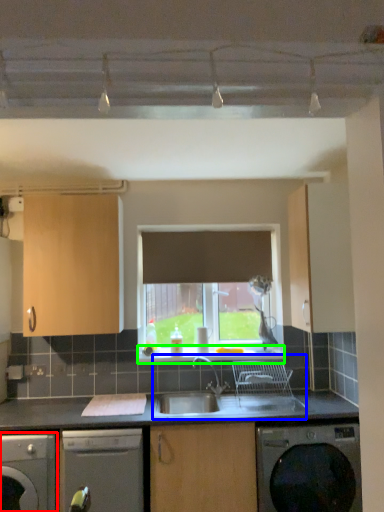
Question: Based on their relative distances, which object is farther from dishwasher (highlighted by a red box)? Choose from sink (highlighted by a blue box) and window sill (highlighted by a green box).

Choices:
 (A) sink
 (B) window sill

Answer: (B)